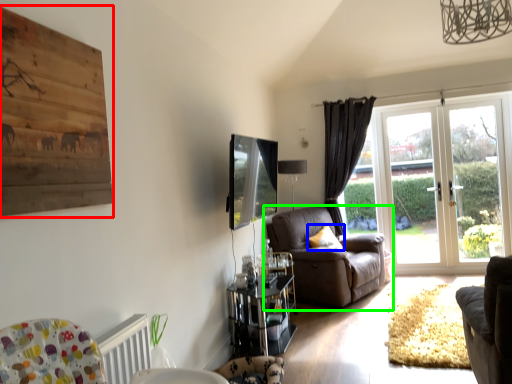
Question: Which is nearer to the picture frame (highlighted by a red box)? pillow (highlighted by a blue box) or chair (highlighted by a green box).

Choices:
 (A) pillow
 (B) chair

Answer: (B)